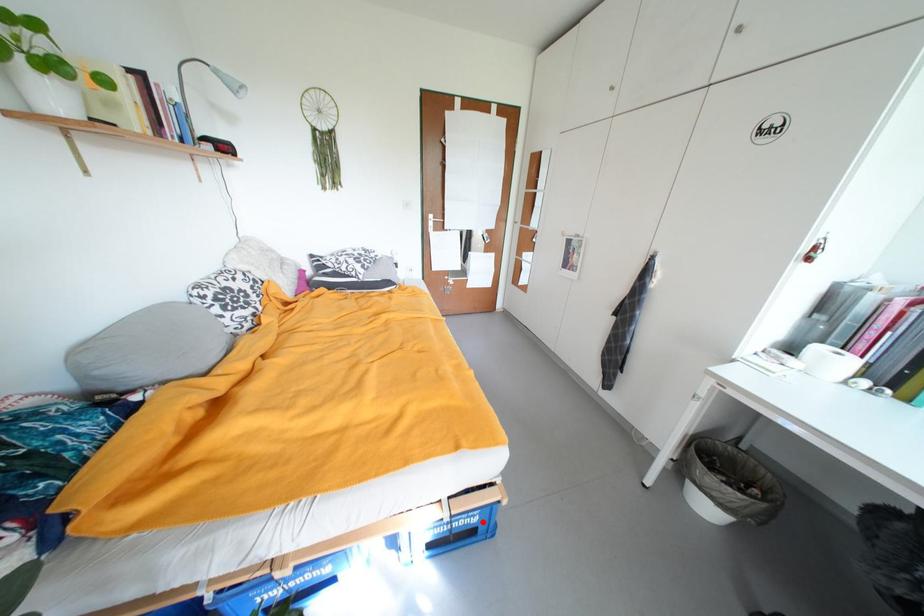
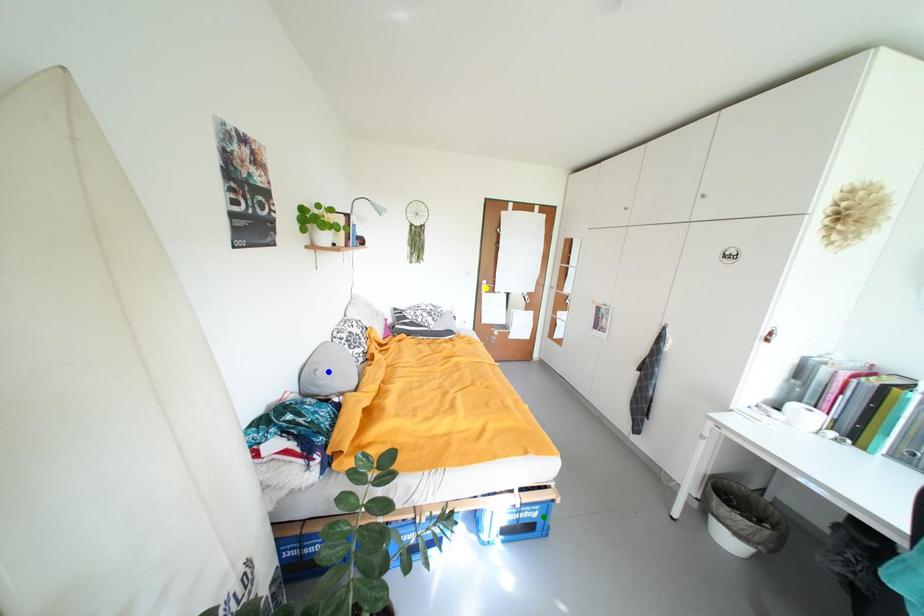
Question: I am providing you with two images of the same scene from different viewpoints. A red point is marked on the first image. You are given multiple points on the second image. Which spot in image 2 lines up with the point in image 1?

Choices:
 (A) yellow point
 (B) blue point
 (C) green point

Answer: (C)